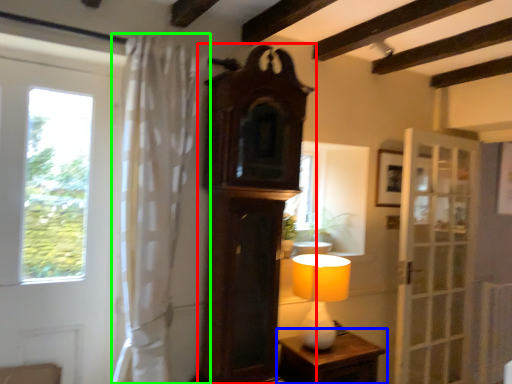
Question: Which object is the farthest from clock (highlighted by a red box)? Choose among these: nightstand (highlighted by a blue box) or curtain (highlighted by a green box).

Choices:
 (A) nightstand
 (B) curtain

Answer: (A)